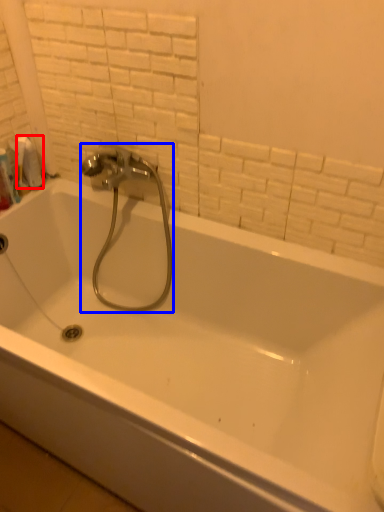
Question: Which object appears closest to the camera in this image, toilet paper (highlighted by a red box) or plumbing fixture (highlighted by a blue box)?

Choices:
 (A) toilet paper
 (B) plumbing fixture

Answer: (B)